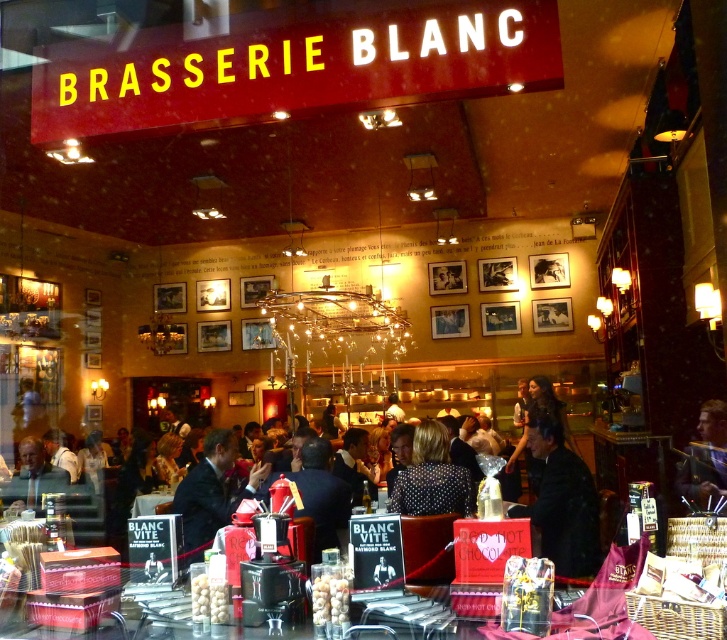
You are a customer at Brasserie Blanc and want to place your coat on the seat next to you. The seat is near the translucent glass table at center and the dark blue suit at center. Which object should you avoid placing your coat near to ensure it doesn not get in the way?

You should avoid placing your coat near the dark blue suit at center because the translucent glass table at center is smaller than the dark blue suit at center, meaning the suit takes up more space and might be occupied.

You are a customer at Brasserie Blanc and want to reach the dark blue suit at center to ask for a recommendation. However, there is a translucent glass table at center in your way. Can you walk around the table to get to the suit?

The translucent glass table at center is in front of the dark blue suit at center, so you can walk around the table to reach the suit since it is blocking the direct path.

You are a customer sitting at a table in Brasserie Blanc. You see two points marked in the scene. The first point is at coordinates point[587,595] and the second is at point[704,497]. Which point is closer to your current position?

Point[587,595] is in front of point[704,497], so it is closer to your current position.